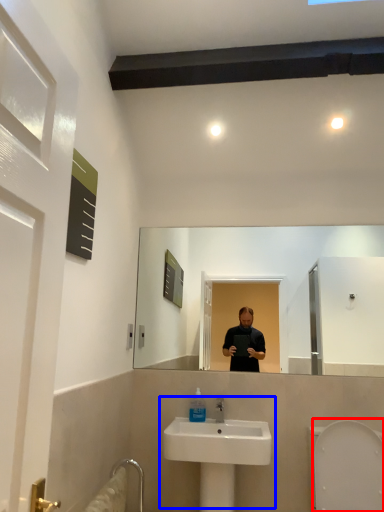
Question: Among these objects, which one is nearest to the camera, bidet (highlighted by a red box) or sink (highlighted by a blue box)?

Choices:
 (A) bidet
 (B) sink

Answer: (A)